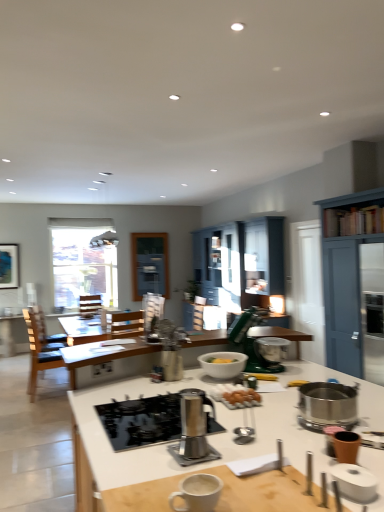
This screenshot has width=384, height=512. Identify the location of white ceramic mug at lower center. (198, 493).

Image resolution: width=384 pixels, height=512 pixels. Describe the element at coordinates (198, 493) in the screenshot. I see `white ceramic mug at lower center` at that location.

What do you see at coordinates (169, 347) in the screenshot? The width and height of the screenshot is (384, 512). I see `metallic silver stand mixer at center, the second appliance viewed from the back` at bounding box center [169, 347].

The image size is (384, 512). What do you see at coordinates (240, 262) in the screenshot?
I see `matte blue cabinet at center, the 1th cabinetry from the left` at bounding box center [240, 262].

This screenshot has width=384, height=512. Describe the element at coordinates (346, 446) in the screenshot. I see `brown matte cup at lower right, which ranks as the fourth appliance in back-to-front order` at that location.

Describe the element at coordinates (193, 424) in the screenshot. I see `satin silver coffee maker at center, the 3th appliance viewed from the front` at that location.

Locate an element on the screen. white glossy countertop at center is located at coordinates (165, 444).

Find the location of a particular element. The image size is (384, 512). stainless steel gas stove at center is located at coordinates (149, 420).

Considering the relative sizes of white ceramic mug at lower center and brown matte cup at lower right, which ranks as the fourth appliance in back-to-front order, in the image provided, is white ceramic mug at lower center bigger than brown matte cup at lower right, which ranks as the fourth appliance in back-to-front order,?

Yes, white ceramic mug at lower center is bigger than brown matte cup at lower right, which ranks as the fourth appliance in back-to-front order.

From a real-world perspective, who is located lower, white ceramic mug at lower center or brown matte cup at lower right, which ranks as the fourth appliance in back-to-front order?

white ceramic mug at lower center is physically lower.

Is point (208, 477) farther from viewer compared to point (352, 437)?

No.

Are white ceramic mug at lower center and brown matte cup at lower right, marked as the second appliance in a front-to-back arrangement, making contact?

No, white ceramic mug at lower center is not beside brown matte cup at lower right, marked as the second appliance in a front-to-back arrangement.

At what (x,y) coordinates should I click in order to perform the action: click on armchair beneath the matte plastic armchair at center, which appears as the 2th armchair when viewed from the left (from a real-world perspective). Please return your answer as a coordinate pair (x, y). This screenshot has height=512, width=384. Looking at the image, I should click on (89, 304).

Is matte plastic armchair at center, which appears as the 2th armchair when viewed from the left, facing towards brown fabric armchair at center, acting as the second armchair starting from the top?

Yes, matte plastic armchair at center, which appears as the 2th armchair when viewed from the left, is facing brown fabric armchair at center, acting as the second armchair starting from the top.

In the scene shown: Considering the sizes of objects matte plastic armchair at center, which is counted as the 1th armchair, starting from the front, and brown fabric armchair at center, the second armchair positioned from the front, in the image provided, who is wider, matte plastic armchair at center, which is counted as the 1th armchair, starting from the front, or brown fabric armchair at center, the second armchair positioned from the front,?

Wider between the two is brown fabric armchair at center, the second armchair positioned from the front.

Does brown matte cup at lower right, marked as the second appliance in a front-to-back arrangement, lie in front of green matte stand mixer at center, positioned as the fifth appliance in front-to-back order?

Yes, brown matte cup at lower right, marked as the second appliance in a front-to-back arrangement, is closer to the viewer.

From a real-world perspective, is brown matte cup at lower right, which ranks as the fourth appliance in back-to-front order, physically above green matte stand mixer at center, placed as the first appliance when sorted from back to front?

No, from a real-world perspective, brown matte cup at lower right, which ranks as the fourth appliance in back-to-front order, is not on top of green matte stand mixer at center, placed as the first appliance when sorted from back to front.

Consider the image. Considering the sizes of brown matte cup at lower right, which ranks as the fourth appliance in back-to-front order, and green matte stand mixer at center, placed as the first appliance when sorted from back to front, in the image, is brown matte cup at lower right, which ranks as the fourth appliance in back-to-front order, taller or shorter than green matte stand mixer at center, placed as the first appliance when sorted from back to front,?

Clearly, brown matte cup at lower right, which ranks as the fourth appliance in back-to-front order, is shorter compared to green matte stand mixer at center, placed as the first appliance when sorted from back to front.

Which is closer, (213, 367) or (75, 278)?

Point (213, 367).

From the image's perspective, between white matte bowl at center and clear glass window at upper left, which one is located above?

clear glass window at upper left, from the image's perspective.

Considering the relative sizes of white matte bowl at center and clear glass window at upper left in the image provided, is white matte bowl at center taller than clear glass window at upper left?

In fact, white matte bowl at center may be shorter than clear glass window at upper left.

Is white matte bowl at center not inside clear glass window at upper left?

white matte bowl at center is positioned outside clear glass window at upper left.

Locate an element on the screen. The height and width of the screenshot is (512, 384). the 2nd appliance to the right of the matte plastic armchair at center, the first armchair from the right, starting your count from the anchor is located at coordinates (193, 424).

From a real-world perspective, which is physically above, satin silver coffee maker at center, the 3th appliance viewed from the front, or matte plastic armchair at center, which appears as the 2th armchair when viewed from the left?

In real-world perspective, matte plastic armchair at center, which appears as the 2th armchair when viewed from the left, is above.

Considering the relative positions of satin silver coffee maker at center, which ranks as the 3th appliance in back-to-front order, and matte plastic armchair at center, which appears as the 2th armchair when viewed from the left, in the image provided, is satin silver coffee maker at center, which ranks as the 3th appliance in back-to-front order, behind matte plastic armchair at center, which appears as the 2th armchair when viewed from the left,?

No, the depth of satin silver coffee maker at center, which ranks as the 3th appliance in back-to-front order, is less than that of matte plastic armchair at center, which appears as the 2th armchair when viewed from the left.

Is satin silver coffee maker at center, which ranks as the 3th appliance in back-to-front order, facing away from matte plastic armchair at center, which appears as the 2th armchair when viewed from the left?

That's not correct — satin silver coffee maker at center, which ranks as the 3th appliance in back-to-front order, is not looking away from matte plastic armchair at center, which appears as the 2th armchair when viewed from the left.

From a real-world perspective, which is physically below, brown wooden chair at left or satin silver coffee maker at center, which ranks as the 3th appliance in back-to-front order?

brown wooden chair at left.

At what (x,y) coordinates should I click in order to perform the action: click on chair on the left of the satin silver coffee maker at center, which ranks as the 3th appliance in back-to-front order. Please return your answer as a coordinate pair (x, y). The height and width of the screenshot is (512, 384). Looking at the image, I should click on (38, 353).

Is point (35, 347) positioned in front of point (189, 421)?

No.

Considering the sizes of objects brown wooden chair at left and satin silver coffee maker at center, the 3th appliance viewed from the front, in the image provided, who is wider, brown wooden chair at left or satin silver coffee maker at center, the 3th appliance viewed from the front,?

With larger width is brown wooden chair at left.

From the image's perspective, which object appears higher, blue painted wood cabinet at right, the second cabinetry from the left, or white paper towel at lower right, which is the first appliance from front to back?

blue painted wood cabinet at right, the second cabinetry from the left, appears higher in the image.

This screenshot has height=512, width=384. What are the coordinates of `the 5th appliance in front of the blue painted wood cabinet at right, which is counted as the 2th cabinetry, starting from the back, counting from the anchor's position` in the screenshot? It's located at (354, 481).

Based on the photo, can we say blue painted wood cabinet at right, the second cabinetry from the left, lies outside white paper towel at lower right, which is the first appliance from front to back?

blue painted wood cabinet at right, the second cabinetry from the left, lies outside white paper towel at lower right, which is the first appliance from front to back,'s area.

Identify the location of tableware below the brown matte cup at lower right, marked as the second appliance in a front-to-back arrangement (from a real-world perspective). (198, 493).

You are a GUI agent. You are given a task and a screenshot of the screen. Output one action in this format:
    pyautogui.click(x=<x>, y=<y>)
    Task: Click on the armchair located above the brown fabric armchair at center, the second armchair positioned from the front (from the image's perspective)
    
    Given the screenshot: What is the action you would take?
    pyautogui.click(x=152, y=310)

Considering their positions, is satin silver coffee maker at center, the 3th appliance viewed from the front, positioned further to brown fabric armchair at center, marked as the 1th armchair in a back-to-front arrangement, than clear glass window at upper left?

satin silver coffee maker at center, the 3th appliance viewed from the front.

Based on their spatial positions, is white paper towel at lower right, which is the first appliance from front to back, or brown matte cup at lower right, marked as the second appliance in a front-to-back arrangement, closer to brown fabric armchair at center, marked as the 1th armchair in a back-to-front arrangement?

brown matte cup at lower right, marked as the second appliance in a front-to-back arrangement.

Estimate the real-world distances between objects in this image. Which object is further from white paper towel at lower right, the 5th appliance from the back, matte blue cabinet at center, the 1th cabinetry from the left, or metallic silver stand mixer at center, which appears as the 4th appliance when viewed from the front?

matte blue cabinet at center, the 1th cabinetry from the left.

Based on their spatial positions, is brown matte cup at lower right, which ranks as the fourth appliance in back-to-front order, or white glossy countertop at center closer to stainless steel gas stove at center?

Among the two, white glossy countertop at center is located nearer to stainless steel gas stove at center.

Consider the image. From the image, which object appears to be nearer to metallic silver stand mixer at center, the second appliance viewed from the back, white ceramic mug at lower center or blue painted wood cabinet at right, the second cabinetry from the left?

The object closer to metallic silver stand mixer at center, the second appliance viewed from the back, is white ceramic mug at lower center.

From the image, which object appears to be farther from satin silver coffee maker at center, which ranks as the 3th appliance in back-to-front order, metallic silver stand mixer at center, the second appliance viewed from the back, or white ceramic mug at lower center?

Based on the image, metallic silver stand mixer at center, the second appliance viewed from the back, appears to be further to satin silver coffee maker at center, which ranks as the 3th appliance in back-to-front order.

When comparing their distances from white ceramic mug at lower center, does brown wooden chair at left or white matte bowl at center seem further?

brown wooden chair at left lies further to white ceramic mug at lower center than the other object.

Estimate the real-world distances between objects in this image. Which object is closer to matte plastic armchair at center, the 1th armchair in the top-to-bottom sequence, green matte stand mixer at center, positioned as the fifth appliance in front-to-back order, or blue painted wood cabinet at right, the second cabinetry from the left?

blue painted wood cabinet at right, the second cabinetry from the left, lies closer to matte plastic armchair at center, the 1th armchair in the top-to-bottom sequence, than the other object.

Locate an element on the screen. The image size is (384, 512). bowl between brown matte cup at lower right, marked as the second appliance in a front-to-back arrangement, and green matte stand mixer at center, positioned as the fifth appliance in front-to-back order, along the z-axis is located at coordinates (223, 364).

The width and height of the screenshot is (384, 512). Identify the location of bowl positioned between stainless steel gas stove at center and matte plastic armchair at center, the 1th armchair in the top-to-bottom sequence, from near to far. (223, 364).

The image size is (384, 512). Find the location of `bowl between white glossy countertop at center and metallic silver stand mixer at center, the second appliance viewed from the back, along the z-axis`. bowl between white glossy countertop at center and metallic silver stand mixer at center, the second appliance viewed from the back, along the z-axis is located at coordinates (223, 364).

This screenshot has height=512, width=384. I want to click on bowl between white paper towel at lower right, which is the first appliance from front to back, and matte plastic armchair at center, arranged as the 2th armchair when ordered from the bottom, from front to back, so click(x=223, y=364).